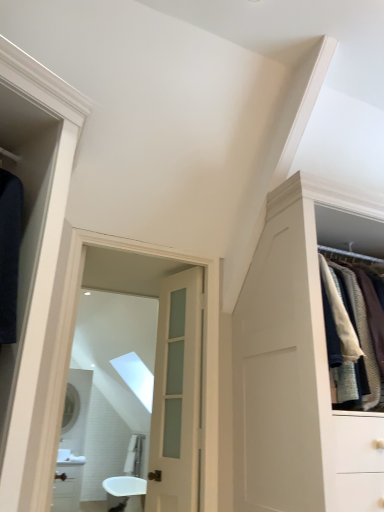
Question: From a real-world perspective, is satin white door at center above or below matte silver mirror at center, the first mirror positioned from the back?

Choices:
 (A) below
 (B) above

Answer: (A)

Question: Do you think satin white door at center is within matte silver mirror at center, positioned as the 2th mirror in front-to-back order, or outside of it?

Choices:
 (A) outside
 (B) inside

Answer: (A)

Question: Which is farther from the white glossy sink at center?

Choices:
 (A) clear glass mirror at center, which appears as the first mirror when viewed from the top
 (B) matte silver mirror at center, placed as the 1th mirror when sorted from left to right
 (C) satin white door at center

Answer: (C)

Question: Estimate the real-world distances between objects in this image. Which object is closer to the matte silver mirror at center, placed as the 1th mirror when sorted from left to right?

Choices:
 (A) satin white door at center
 (B) clear glass mirror at center, positioned as the 1th mirror in front-to-back order
 (C) white glossy sink at center

Answer: (A)